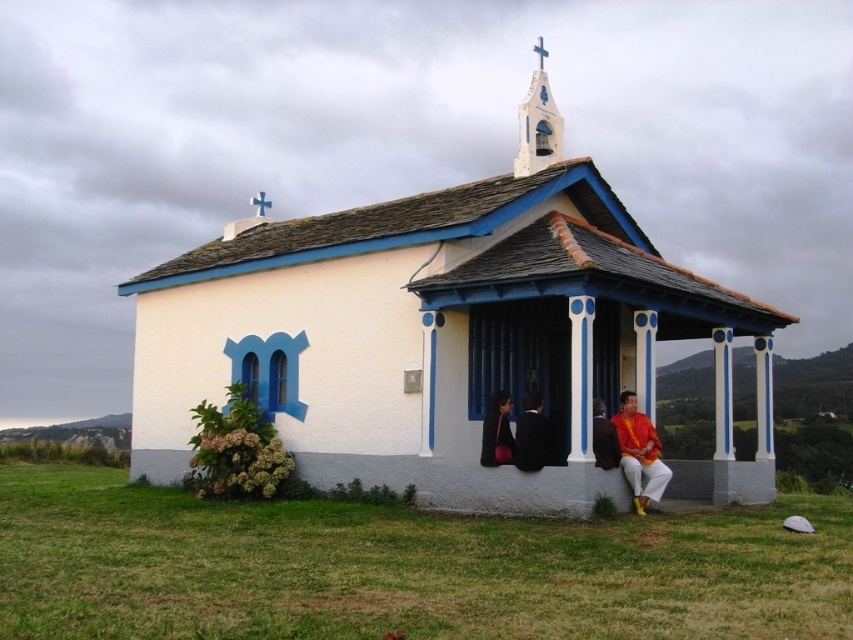
Question: Can you confirm if white painted wall at center is positioned below shiny orange fabric at lower right?

Choices:
 (A) no
 (B) yes

Answer: (A)

Question: Does matte black suit at center appear over shiny orange fabric at lower right?

Choices:
 (A) no
 (B) yes

Answer: (B)

Question: Which of the following is the closest to the observer?

Choices:
 (A) (482, 456)
 (B) (343, 445)
 (C) (488, 422)
 (D) (532, 49)

Answer: (A)

Question: Which is farther from the matte black jacket at center?

Choices:
 (A) white painted wood bell at upper center
 (B) shiny orange fabric at lower right

Answer: (A)

Question: Estimate the real-world distances between objects in this image. Which object is closer to the shiny orange fabric at lower right?

Choices:
 (A) matte black suit at center
 (B) matte black jacket at center
 (C) white painted wood bell at upper center
 (D) white painted wall at center

Answer: (A)

Question: In this image, where is shiny orange fabric at lower right located relative to white painted wood bell at upper center?

Choices:
 (A) left
 (B) right

Answer: (A)